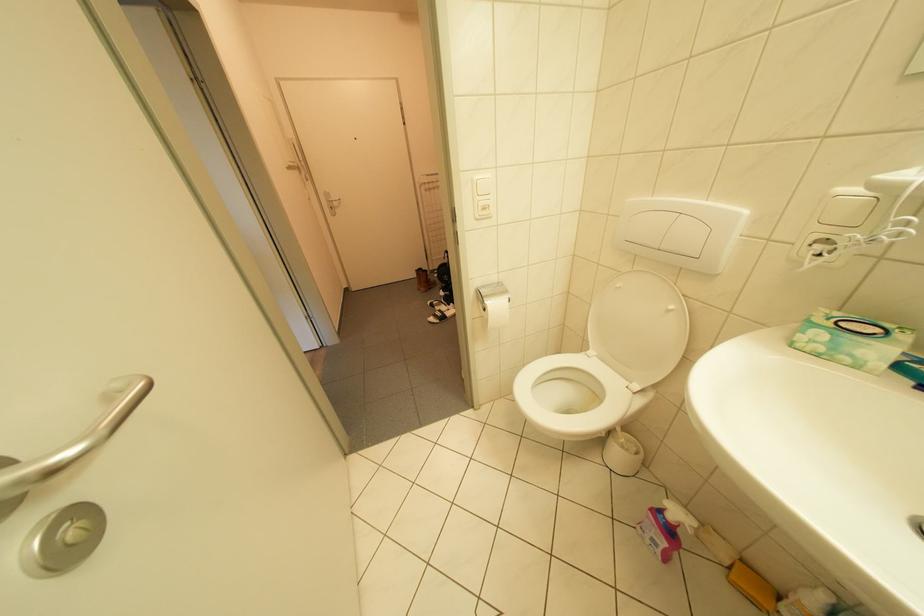
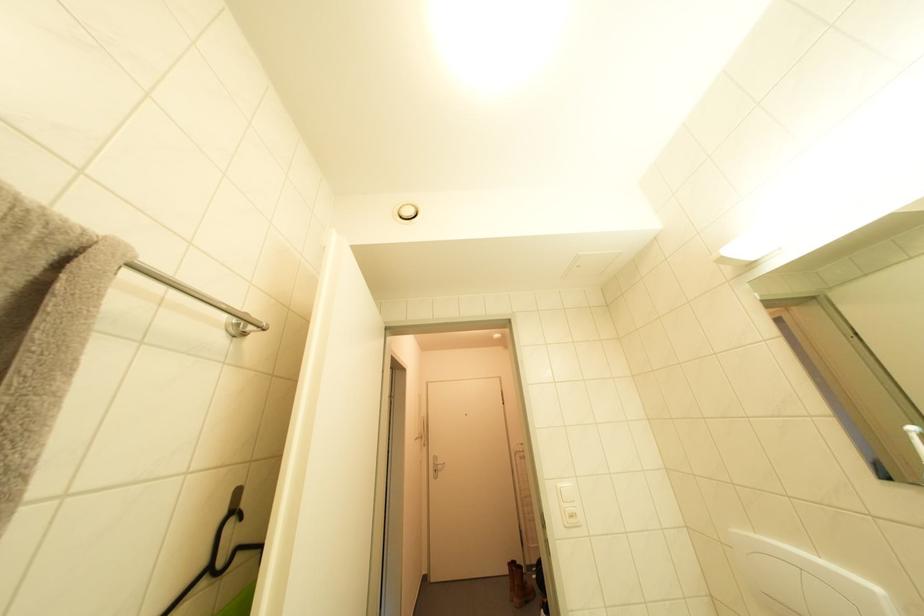
First-person continuous shooting, in which direction is the camera rotating?

The camera's rotation is toward left-up.